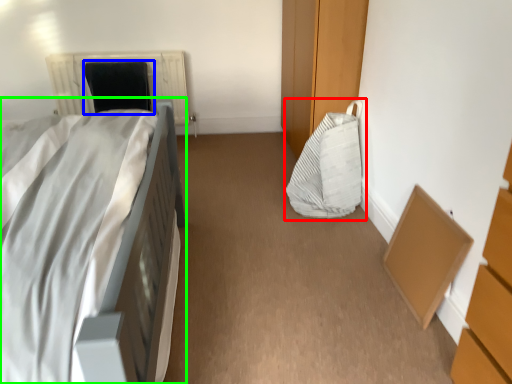
Question: Based on their relative distances, which object is nearer to bean bag chair (highlighted by a red box)? Choose from bean bag chair (highlighted by a blue box) and bed (highlighted by a green box).

Choices:
 (A) bean bag chair
 (B) bed

Answer: (B)